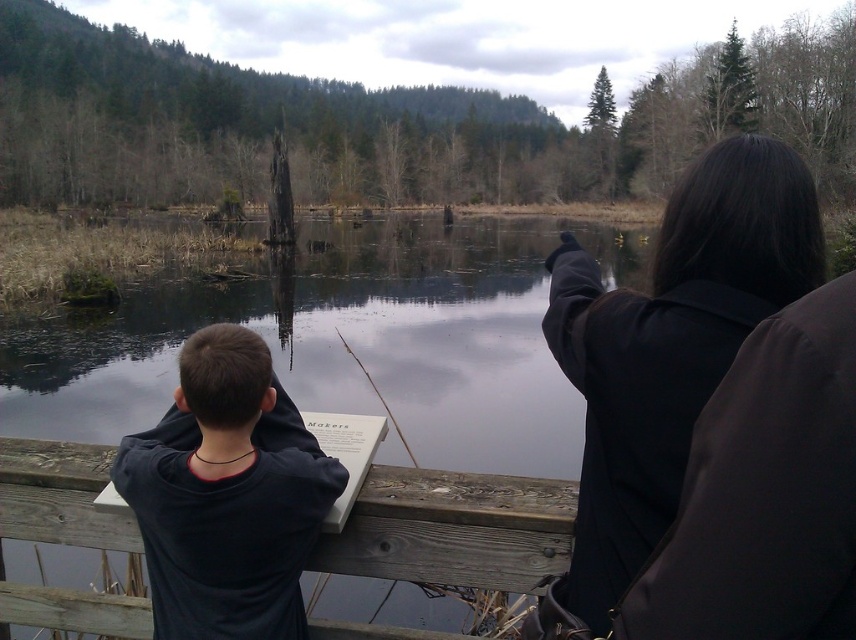
Does black matte coat at upper right lie behind wooden sign at lower left?

No.

Measure the distance from black matte coat at upper right to wooden sign at lower left.

They are 43.72 centimeters apart.

Measure the distance between point (716, 332) and camera.

Point (716, 332) is 4.63 feet from camera.

This screenshot has width=856, height=640. I want to click on black matte coat at upper right, so click(x=670, y=346).

Who is more forward, (x=821, y=237) or (x=296, y=413)?

Point (x=821, y=237) is more forward.

Is black matte coat at upper right further to the viewer compared to dark blue shirt at center?

No, it is not.

You are a GUI agent. You are given a task and a screenshot of the screen. Output one action in this format:
    pyautogui.click(x=<x>, y=<y>)
    Task: Click on the black matte coat at upper right
    This screenshot has width=856, height=640.
    Given the screenshot: What is the action you would take?
    pyautogui.click(x=670, y=346)

Is dark blue shirt at center positioned behind wooden sign at lower left?

That is False.

This screenshot has width=856, height=640. Describe the element at coordinates (227, 496) in the screenshot. I see `dark blue shirt at center` at that location.

Find the location of a particular element. dark blue shirt at center is located at coordinates (227, 496).